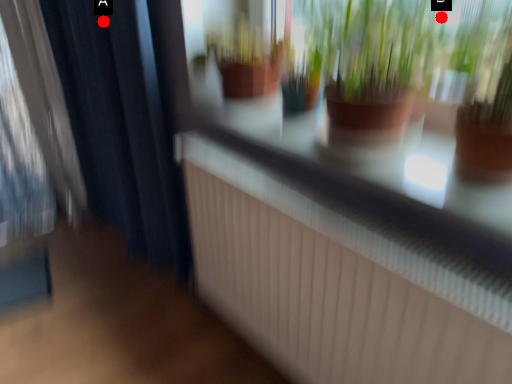
Question: Two points are circled on the image, labeled by A and B beside each circle. Which point is closer to the camera taking this photo?

Choices:
 (A) A is closer
 (B) B is closer

Answer: (B)